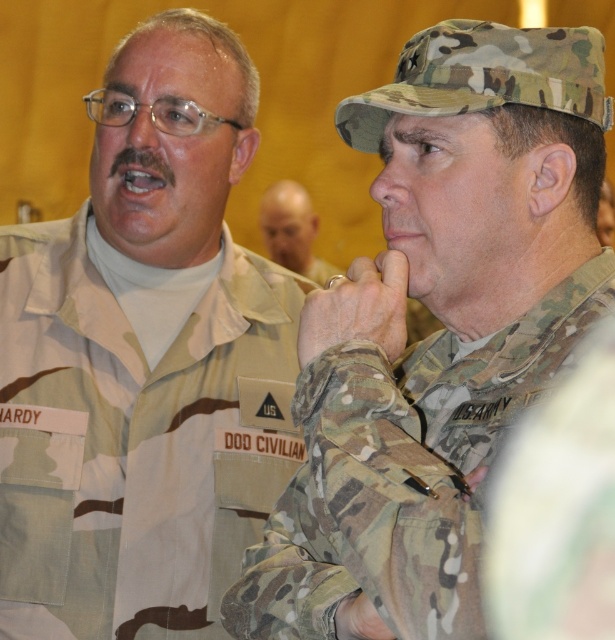
Can you confirm if camouflage uniform at left is positioned to the right of camouflage fabric hand at center?

Incorrect, camouflage uniform at left is not on the right side of camouflage fabric hand at center.

Image resolution: width=615 pixels, height=640 pixels. Describe the element at coordinates (145, 358) in the screenshot. I see `camouflage uniform at left` at that location.

Is point (215, 52) positioned before point (389, 340)?

No, it is not.

The width and height of the screenshot is (615, 640). I want to click on camouflage uniform at left, so click(145, 358).

Which is in front, point (373, 328) or point (276, 188)?

Point (373, 328) is in front.

Is camouflage fabric hand at center bigger than smooth bald head at center?

No.

Which is behind, point (381, 269) or point (308, 225)?

Point (308, 225)

The width and height of the screenshot is (615, 640). Identify the location of camouflage fabric hand at center. (359, 308).

Who is positioned more to the right, camouflage fabric uniform at center or matte camouflage glove at center?

Positioned to the right is camouflage fabric uniform at center.

Is camouflage fabric uniform at center positioned before matte camouflage glove at center?

Yes, camouflage fabric uniform at center is in front of matte camouflage glove at center.

The height and width of the screenshot is (640, 615). What do you see at coordinates (402, 472) in the screenshot?
I see `camouflage fabric uniform at center` at bounding box center [402, 472].

I want to click on camouflage fabric uniform at center, so click(402, 472).